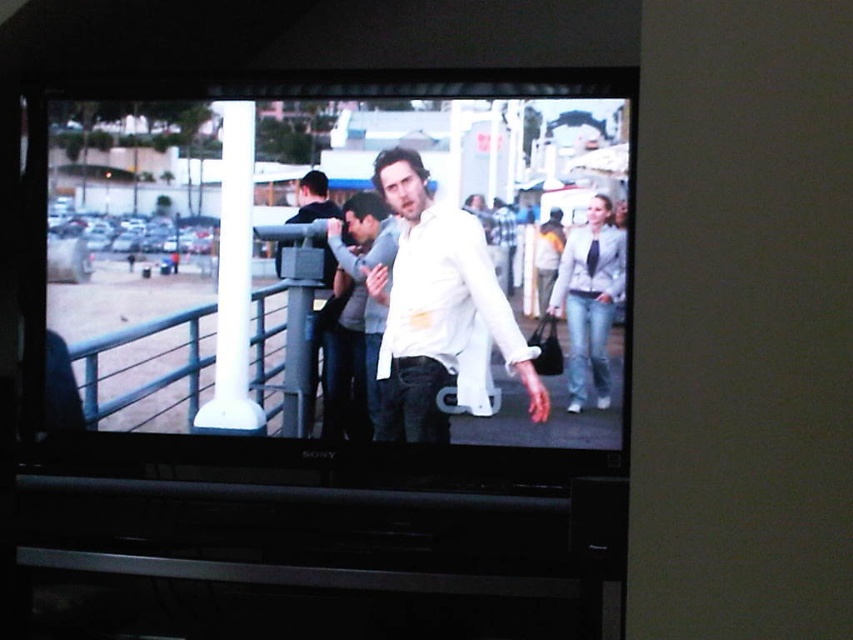
You are a costume designer reviewing a film scene. You notice two characters in the frame. The first is wearing a white matte shirt at center, and the second is wearing a light gray textured jacket at right. Based on the visual information provided, which character appears to be closer to the camera?

The white matte shirt at center appears larger in size compared to the light gray textured jacket at right, indicating that the character wearing the white matte shirt at center is closer to the camera.

You are trying to identify two people in the scene. The first person is wearing a white glossy shirt at center, and the second is wearing a white matte shirt at center. Which of these two shirts is bigger in size?

The white glossy shirt at center is larger in size compared to the white matte shirt at center.

Based on the photo, you are a movie director analyzing the scene on the TV screen. You notice two characters, the white matte shirt at center and the light gray textured jacket at right. Which character is standing in front of the other?

The white matte shirt at center is positioned over the light gray textured jacket at right, meaning it is in front of the other character.